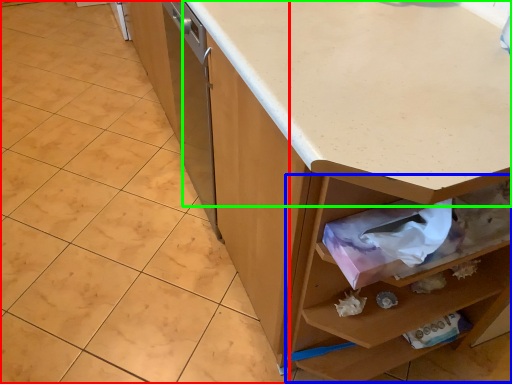
Question: Which object is positioned closest to granite (highlighted by a red box)? Select from drawer (highlighted by a blue box) and countertop (highlighted by a green box).

Choices:
 (A) drawer
 (B) countertop

Answer: (A)